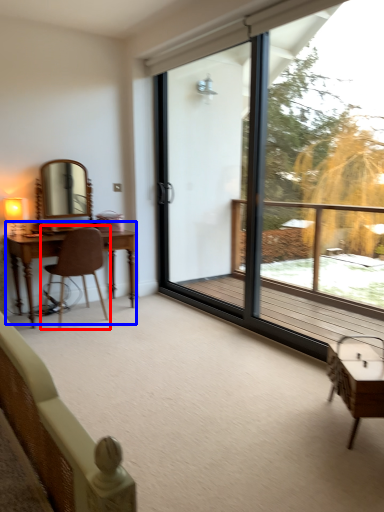
Question: Among these objects, which one is farthest to the camera, chair (highlighted by a red box) or table (highlighted by a blue box)?

Choices:
 (A) chair
 (B) table

Answer: (B)